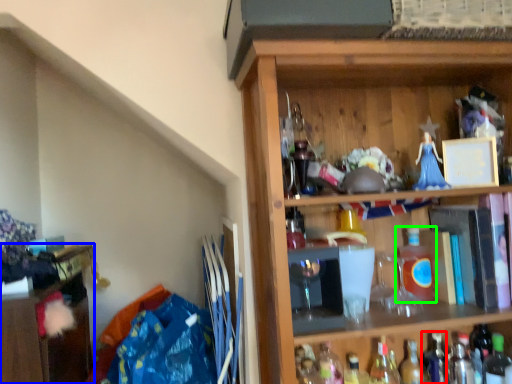
Question: Which object is positioned closest to bottle (highlighted by a red box)? Select from cabinetry (highlighted by a blue box) and bottle (highlighted by a green box).

Choices:
 (A) cabinetry
 (B) bottle

Answer: (B)